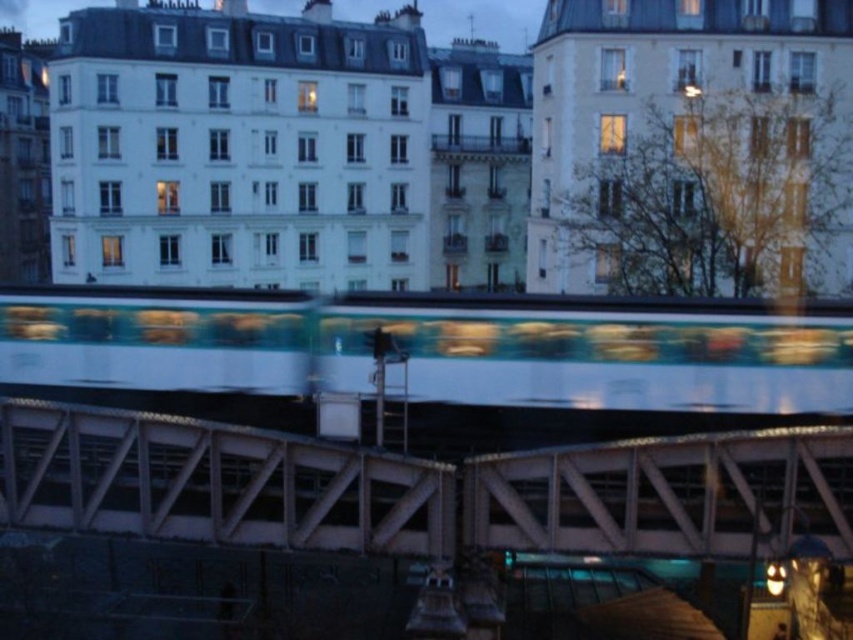
Question: Which point is farther from the camera taking this photo?

Choices:
 (A) (722, 496)
 (B) (332, 348)

Answer: (B)

Question: Does metallic bridge at center appear under white glossy subway at center?

Choices:
 (A) no
 (B) yes

Answer: (B)

Question: Which point appears closest to the camera in this image?

Choices:
 (A) (624, 381)
 (B) (821, 436)

Answer: (B)

Question: Can you confirm if metallic bridge at center is thinner than white glossy subway at center?

Choices:
 (A) yes
 (B) no

Answer: (A)

Question: Which object is farther from the camera taking this photo?

Choices:
 (A) white glossy subway at center
 (B) metallic bridge at center

Answer: (A)

Question: Is the position of metallic bridge at center more distant than that of white glossy subway at center?

Choices:
 (A) no
 (B) yes

Answer: (A)